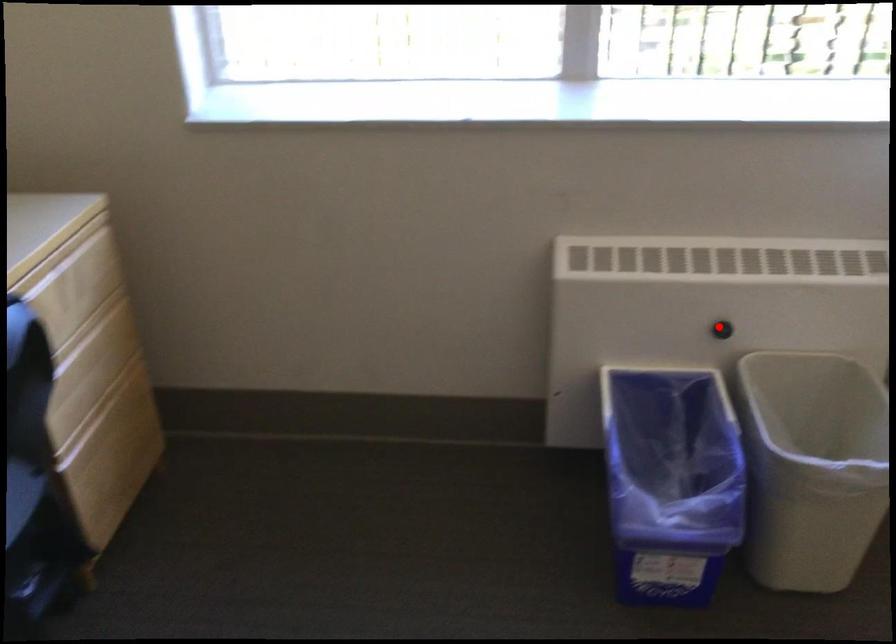
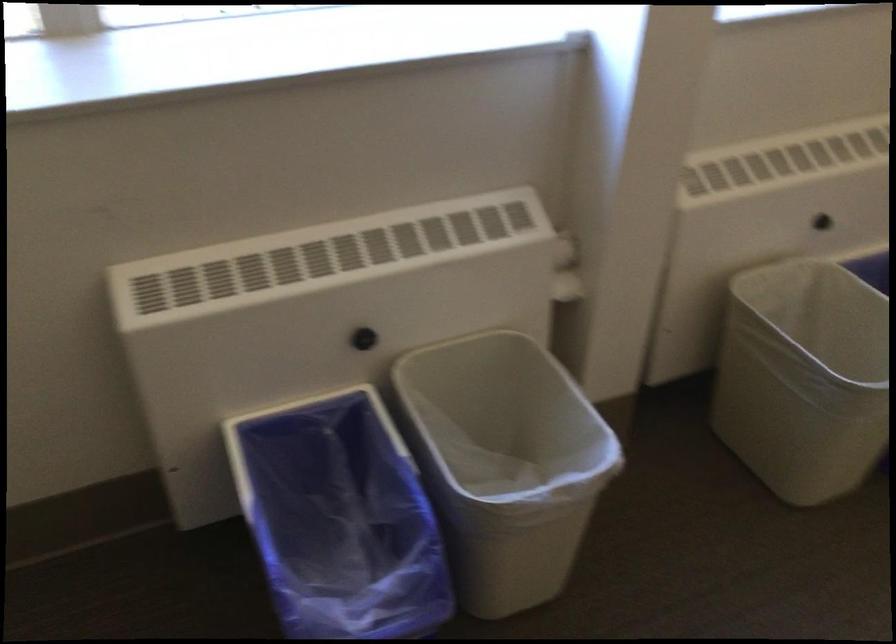
Question: I am providing you with two images of the same scene from different viewpoints. Image1 has a red point marked. In image2, the corresponding 3D location appears at what relative position? Reply with the corresponding letter.

Choices:
 (A) Closer
 (B) Farther

Answer: (A)